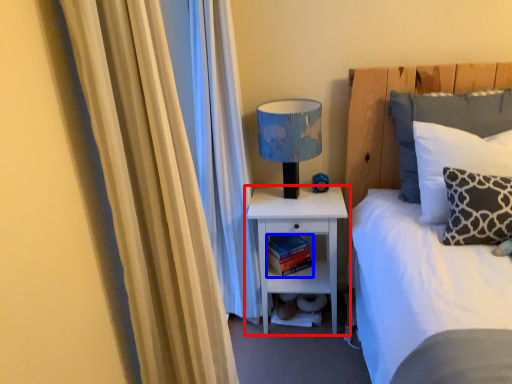
Question: Which object is further to the camera taking this photo, nightstand (highlighted by a red box) or book (highlighted by a blue box)?

Choices:
 (A) nightstand
 (B) book

Answer: (B)